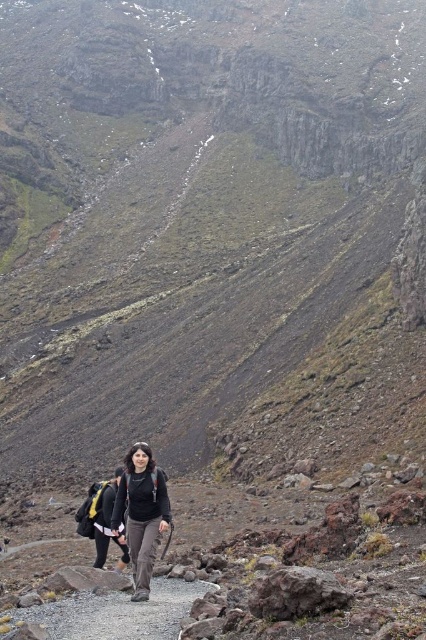
Question: Which point appears closest to the camera in this image?

Choices:
 (A) (42, 621)
 (B) (138, 534)

Answer: (A)

Question: Can you confirm if gray gravel path at center is positioned above matte black backpack at center?

Choices:
 (A) no
 (B) yes

Answer: (A)

Question: Where is gray gravel path at center located in relation to matte black backpack at center in the image?

Choices:
 (A) above
 (B) below

Answer: (B)

Question: Which object appears closest to the camera in this image?

Choices:
 (A) gray gravel path at center
 (B) matte black backpack at center

Answer: (A)

Question: Can you confirm if gray gravel path at center is positioned below matte black backpack at center?

Choices:
 (A) no
 (B) yes

Answer: (B)